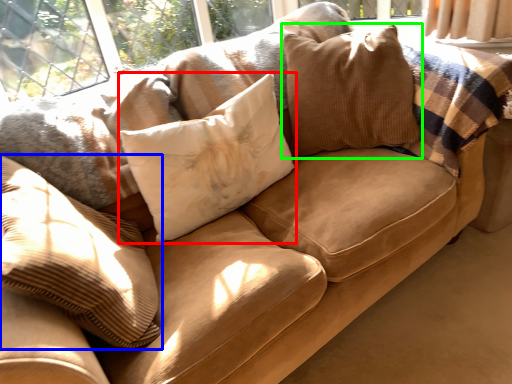
Question: Which object is positioned farthest from pillow (highlighted by a red box)? Select from pillow (highlighted by a blue box) and pillow (highlighted by a green box).

Choices:
 (A) pillow
 (B) pillow

Answer: (A)